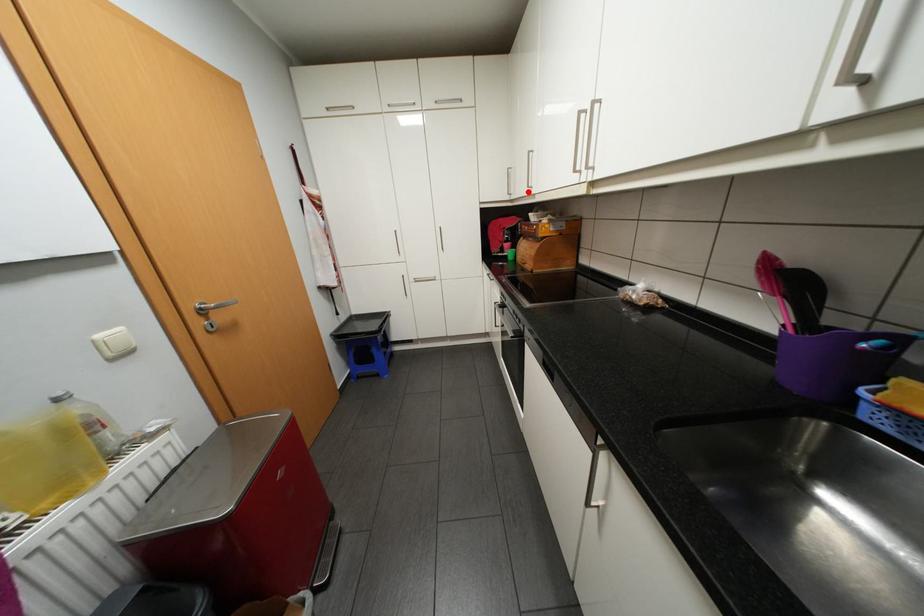
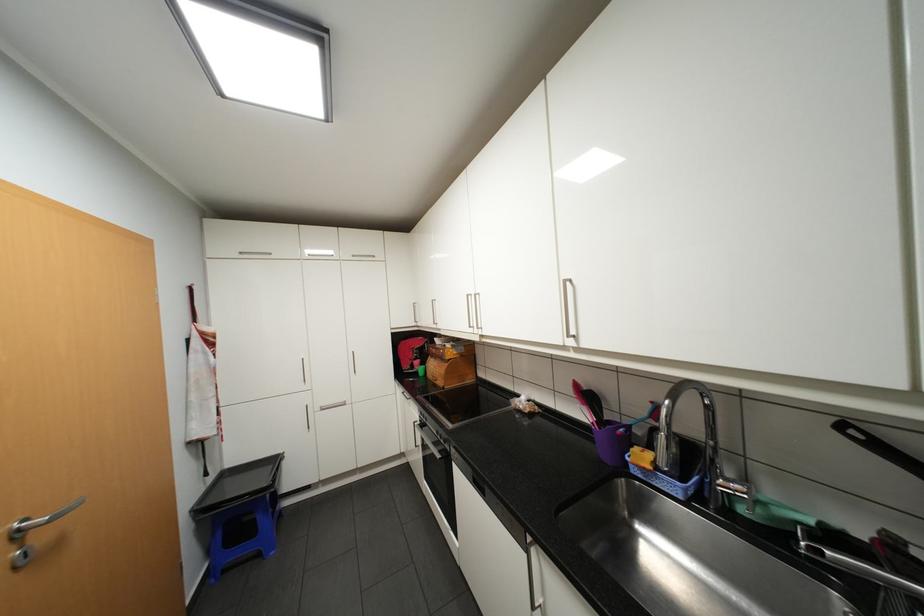
Question: A red point is marked in image1. In image2, is the corresponding 3D point closer to the camera or farther? Reply with the corresponding letter.

Choices:
 (A) The corresponding 3D point is closer.
 (B) The corresponding 3D point is farther.

Answer: (B)